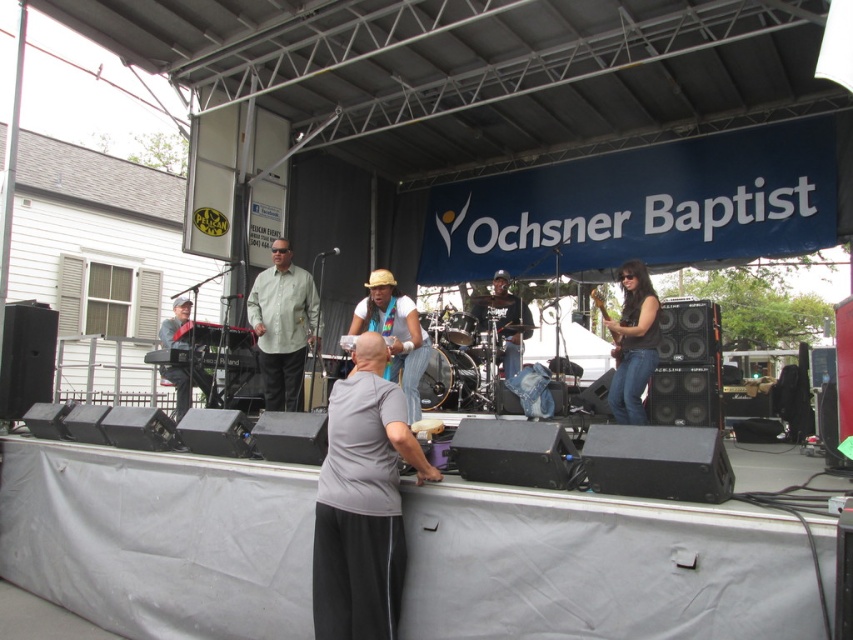
Who is higher up, matte straw hat at center or wooden electric guitar at center?

wooden electric guitar at center

Identify the location of matte straw hat at center. (393, 333).

Consider the image. Between gray matte shirt at center and matte straw hat at center, which one is positioned higher?

matte straw hat at center is higher up.

Can you confirm if gray matte shirt at center is positioned to the left of matte straw hat at center?

In fact, gray matte shirt at center is to the right of matte straw hat at center.

Which is behind, point (386, 582) or point (407, 387)?

Positioned behind is point (407, 387).

I want to click on gray matte shirt at center, so click(x=363, y=502).

Is gray matte shirt at center closer to camera compared to matte green shirt at center?

Yes.

Who is positioned more to the left, gray matte shirt at center or matte green shirt at center?

Positioned to the left is matte green shirt at center.

The width and height of the screenshot is (853, 640). Identify the location of gray matte shirt at center. coord(363,502).